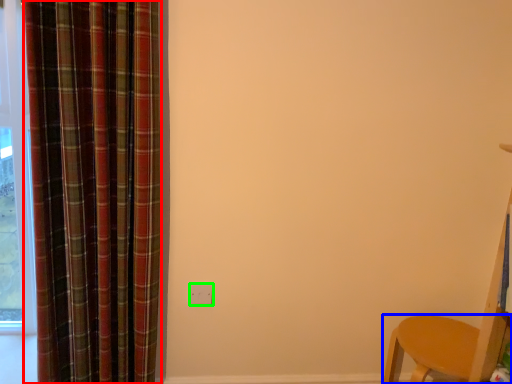
Question: Which object is positioned closest to curtain (highlighted by a red box)? Select from furniture (highlighted by a blue box) and electric outlet (highlighted by a green box).

Choices:
 (A) furniture
 (B) electric outlet

Answer: (B)